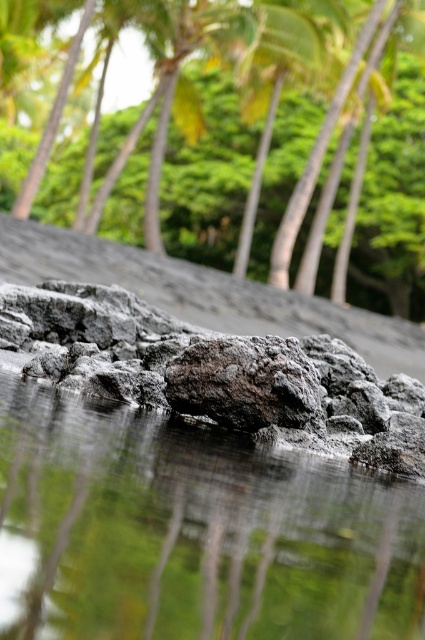
You are standing at the point with coordinates of 0.5,0.5 in the image. You want to reach the reflective wet rock at center. Which direction should you move to get closer to it?

Since the reflective wet rock at center is located at point (192, 531), you should move towards the right and slightly downward from your current position at (212, 320) to reach it.

You are standing at the edge of the water in the scene and want to reach both points labeled as point (x=198, y=376) and point (x=314, y=58). Which point will you encounter first as you move forward?

Point (x=198, y=376) is closer to the viewer than point (x=314, y=58), so you will encounter point (x=198, y=376) first as you move forward.